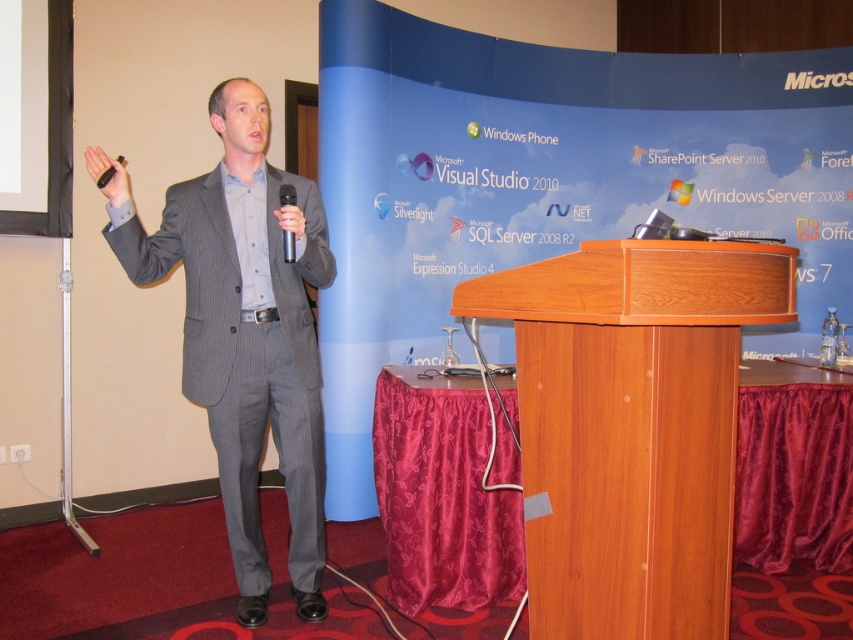
Looking at this image, measure the distance between wooden podium at center and camera.

wooden podium at center is 5.35 feet away from camera.

Can you confirm if wooden podium at center is wider than black plastic microphone at center?

Yes, wooden podium at center is wider than black plastic microphone at center.

Is point (605, 618) positioned before point (283, 205)?

Yes, it is.

Where is `wooden podium at center`? This screenshot has width=853, height=640. wooden podium at center is located at coordinates (631, 426).

Is wooden podium at center positioned in front of black matte microphone at upper left?

That is True.

In the scene shown: Who is more distant from viewer, (607, 499) or (105, 170)?

The point (105, 170) is more distant.

Locate an element on the screen. This screenshot has width=853, height=640. wooden podium at center is located at coordinates (631, 426).

Between gray pinstripe suit at left and black matte microphone at upper left, which one has less height?

Standing shorter between the two is black matte microphone at upper left.

Is gray pinstripe suit at left thinner than black matte microphone at upper left?

No, gray pinstripe suit at left is not thinner than black matte microphone at upper left.

Is point (264, 364) closer to camera compared to point (105, 172)?

No.

Where is `gray pinstripe suit at left`? This screenshot has width=853, height=640. gray pinstripe suit at left is located at coordinates (245, 332).